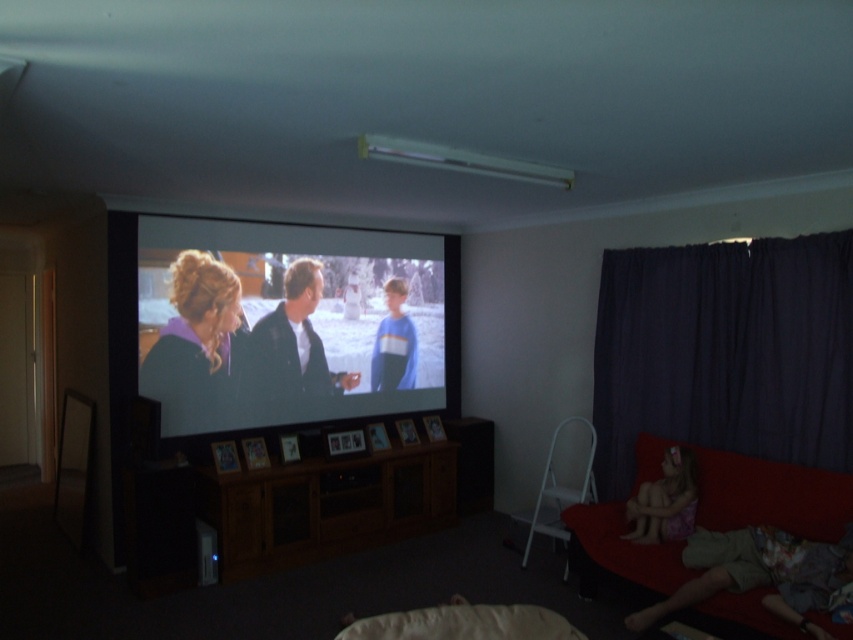
You are sitting on the red fabric couch at lower right and want to reach the brown wood entertainment center at center to grab a remote. Is the entertainment center within easy reach from your current position?

The brown wood entertainment center at center is to the left of the red fabric couch at lower right, so it should be within easy reach from your current position on the red fabric couch at lower right.